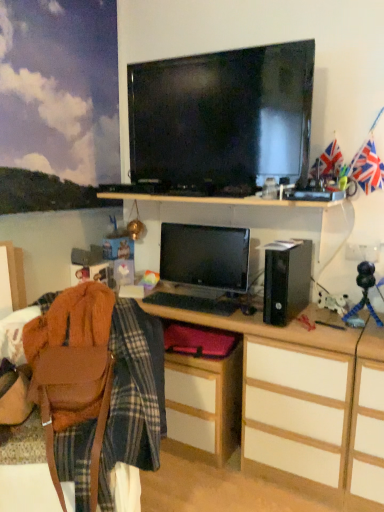
Question: Is matte wood cabinet at lower center bigger than union jack flag at upper right?

Choices:
 (A) yes
 (B) no

Answer: (A)

Question: Is matte wood cabinet at lower center in contact with union jack flag at upper right?

Choices:
 (A) no
 (B) yes

Answer: (A)

Question: Does matte wood cabinet at lower center have a lesser width compared to union jack flag at upper right?

Choices:
 (A) no
 (B) yes

Answer: (A)

Question: Can you confirm if matte wood cabinet at lower center is positioned to the left of union jack flag at upper right?

Choices:
 (A) no
 (B) yes

Answer: (B)

Question: Is matte wood cabinet at lower center positioned before union jack flag at upper right?

Choices:
 (A) yes
 (B) no

Answer: (B)

Question: From a real-world perspective, is matte wood cabinet at lower center positioned over union jack flag at upper right based on gravity?

Choices:
 (A) no
 (B) yes

Answer: (A)

Question: Could you tell me if union jack flag at upper right is turned towards matte black television at upper center?

Choices:
 (A) no
 (B) yes

Answer: (A)

Question: Does union jack flag at upper right have a smaller size compared to matte black television at upper center?

Choices:
 (A) yes
 (B) no

Answer: (A)

Question: From a real-world perspective, is union jack flag at upper right on top of matte black television at upper center?

Choices:
 (A) yes
 (B) no

Answer: (B)

Question: Does union jack flag at upper right appear on the right side of matte black television at upper center?

Choices:
 (A) no
 (B) yes

Answer: (B)

Question: Is union jack flag at upper right next to matte black television at upper center and touching it?

Choices:
 (A) yes
 (B) no

Answer: (B)

Question: From the image's perspective, does union jack flag at upper right appear lower than matte black television at upper center?

Choices:
 (A) yes
 (B) no

Answer: (A)

Question: Can you confirm if matte black television at upper center is shorter than union jack flag at upper right?

Choices:
 (A) no
 (B) yes

Answer: (A)